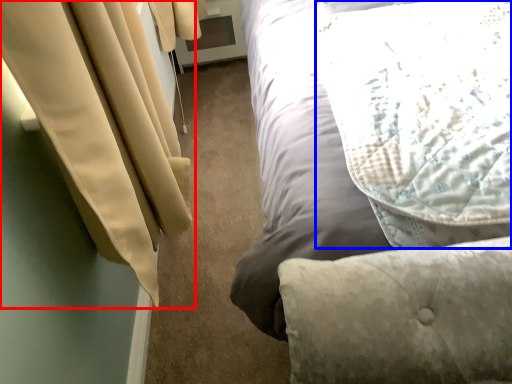
Question: Which object appears closest to the camera in this image, curtain (highlighted by a red box) or pillow (highlighted by a blue box)?

Choices:
 (A) curtain
 (B) pillow

Answer: (A)